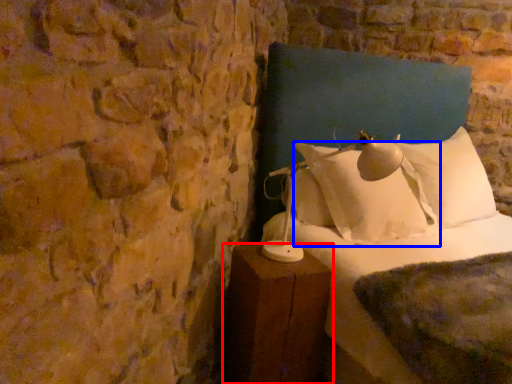
Question: Which of the following is the farthest to the observer, furniture (highlighted by a red box) or pillow (highlighted by a blue box)?

Choices:
 (A) furniture
 (B) pillow

Answer: (B)